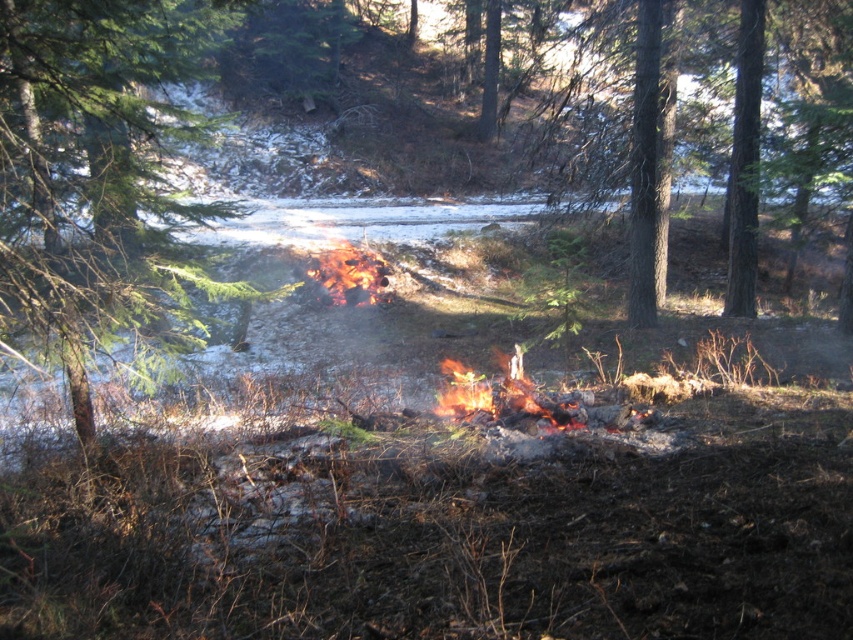
From the picture: You are an observer in the winter forest scene. You notice the green leafy tree at center and the charred wood fire at center. Which object is taller?

The green leafy tree at center is taller than the charred wood fire at center.